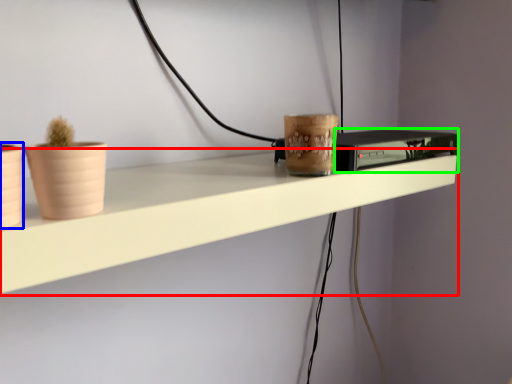
Question: Considering the real-world distances, which object is closest to shelf (highlighted by a red box)? flowerpot (highlighted by a blue box) or appliance (highlighted by a green box).

Choices:
 (A) flowerpot
 (B) appliance

Answer: (B)